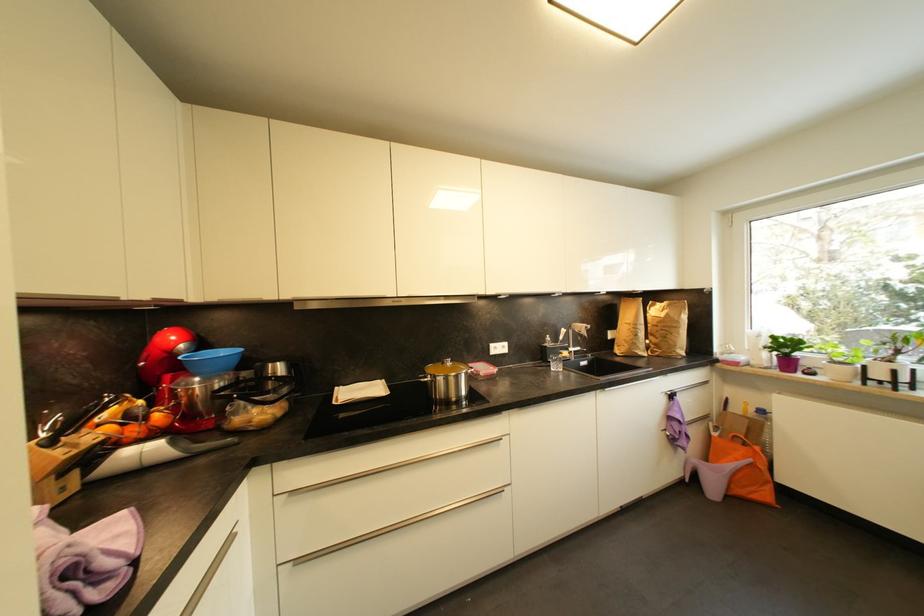
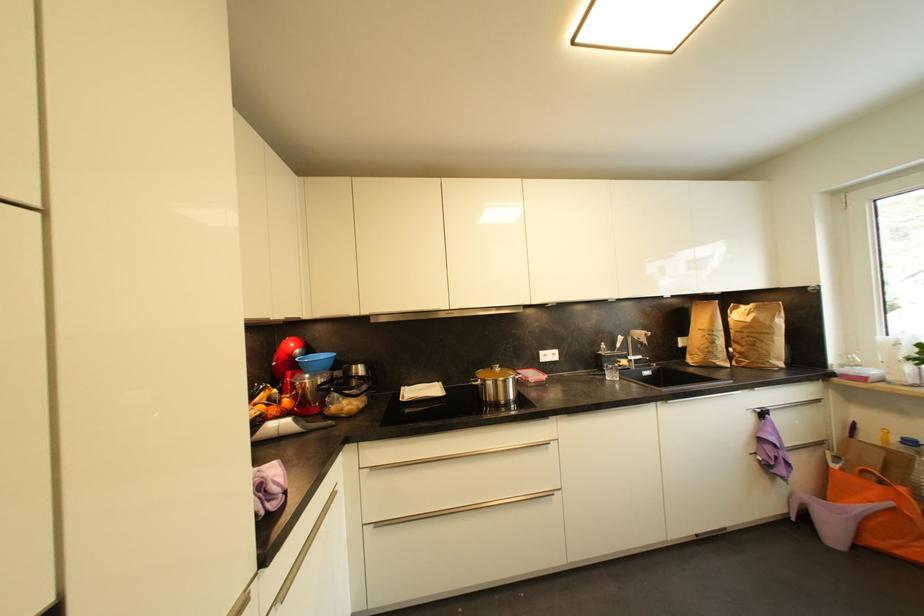
The point at (711, 419) is marked in the first image. Where is the corresponding point in the second image?

(825, 446)